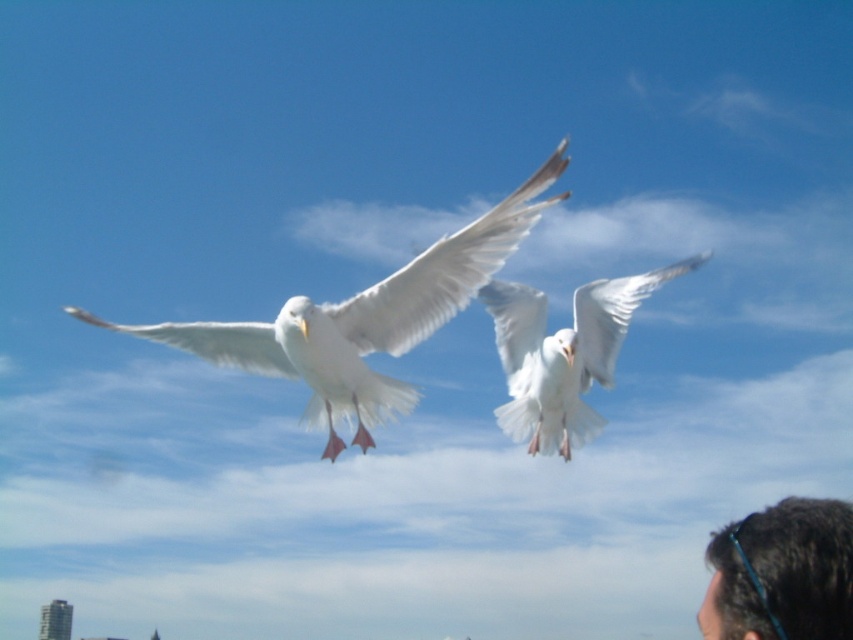
Does white feathered bird at upper center have a greater width compared to dark brown hair at lower right?

Correct, the width of white feathered bird at upper center exceeds that of dark brown hair at lower right.

Which is in front, point (532, 420) or point (772, 557)?

Point (772, 557) is more forward.

Is point (593, 422) positioned after point (724, 611)?

Yes, it is.

Locate an element on the screen. This screenshot has height=640, width=853. white feathered bird at upper center is located at coordinates (563, 353).

From the picture: Is white feathered bird at center above dark brown hair at lower right?

Yes.

Between point (474, 230) and point (804, 572), which one is positioned in front?

Point (804, 572)

Where is `white feathered bird at center`? white feathered bird at center is located at coordinates (364, 320).

Can you confirm if white feathered bird at center is taller than white feathered bird at upper center?

Yes.

Which is below, white feathered bird at center or white feathered bird at upper center?

Positioned lower is white feathered bird at upper center.

This screenshot has height=640, width=853. What do you see at coordinates (364, 320) in the screenshot?
I see `white feathered bird at center` at bounding box center [364, 320].

Find the location of a particular element. The height and width of the screenshot is (640, 853). white feathered bird at center is located at coordinates (364, 320).